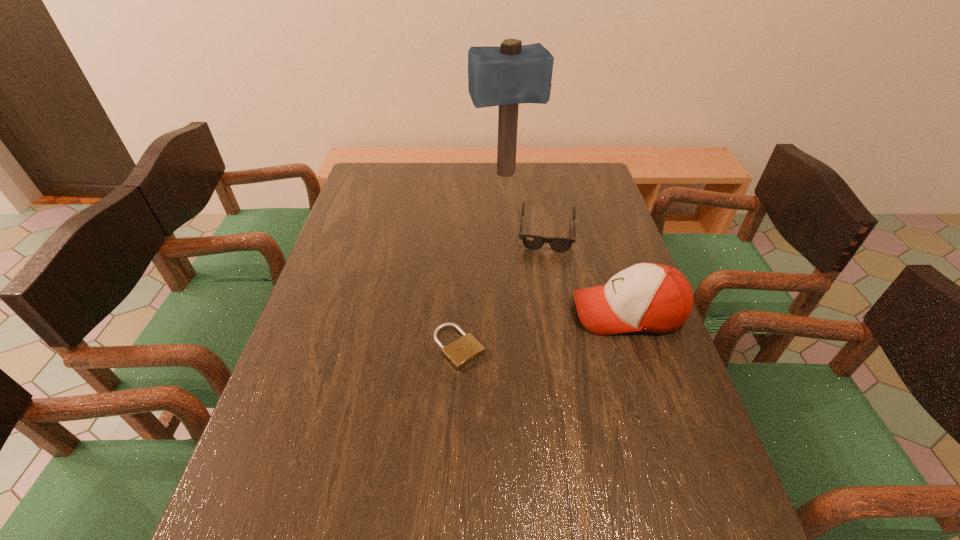
Locate an element on the screen. vacant region located 0.190m on the striking surface of the tallest object is located at coordinates (523, 218).

The width and height of the screenshot is (960, 540). Find the location of `vacant space located 0.310m on the striking surface of the tallest object`. vacant space located 0.310m on the striking surface of the tallest object is located at coordinates (532, 240).

The width and height of the screenshot is (960, 540). I want to click on free space located 0.310m on the striking surface of the tallest object, so click(x=532, y=240).

Identify the location of vacant space located on the temples of the second farthest object. (542, 304).

Find the location of a particular element. vacant space located on the temples of the second farthest object is located at coordinates (540, 349).

Locate an element on the screen. Image resolution: width=960 pixels, height=540 pixels. vacant space located on the temples of the second farthest object is located at coordinates (540, 330).

Find the location of a particular element. This screenshot has width=960, height=540. object positioned at the far edge is located at coordinates (506, 76).

I want to click on baseball cap located at the right edge, so click(649, 297).

This screenshot has width=960, height=540. Identify the location of sunglasses that is at the right edge. (534, 242).

This screenshot has width=960, height=540. In order to click on vacant region at the far edge in this screenshot , I will do `click(433, 170)`.